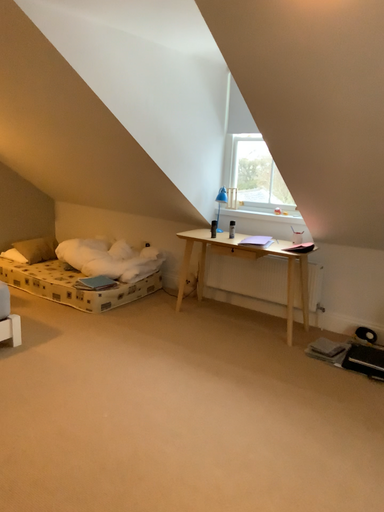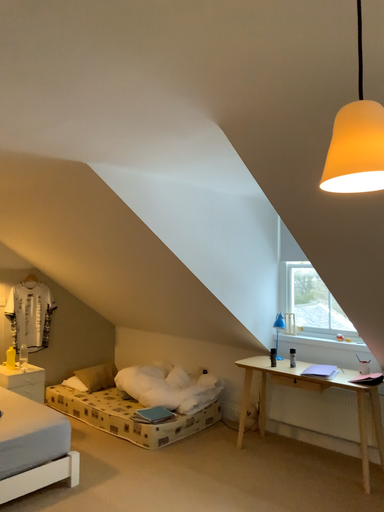
Question: Which way did the camera rotate in the video?

Choices:
 (A) rotated downward
 (B) rotated upward

Answer: (B)